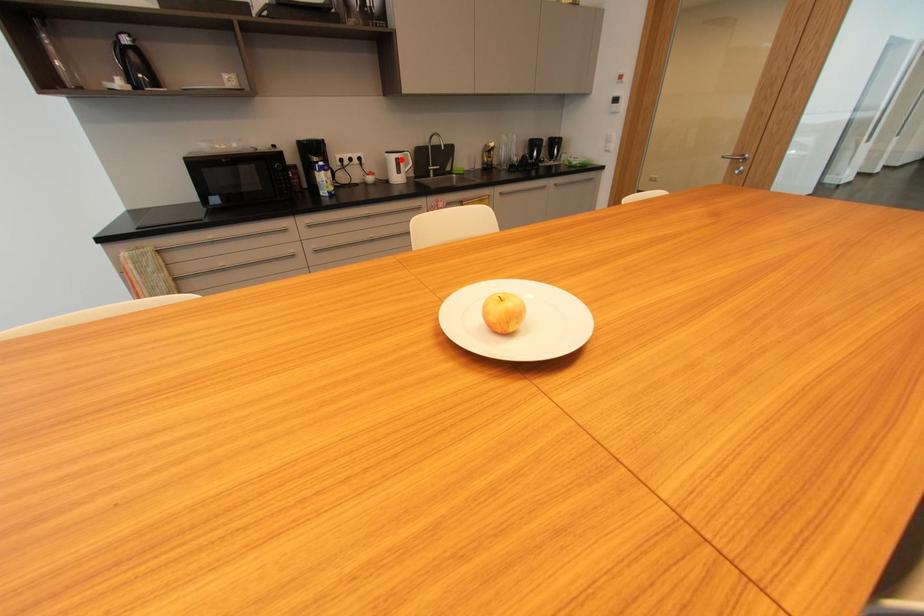
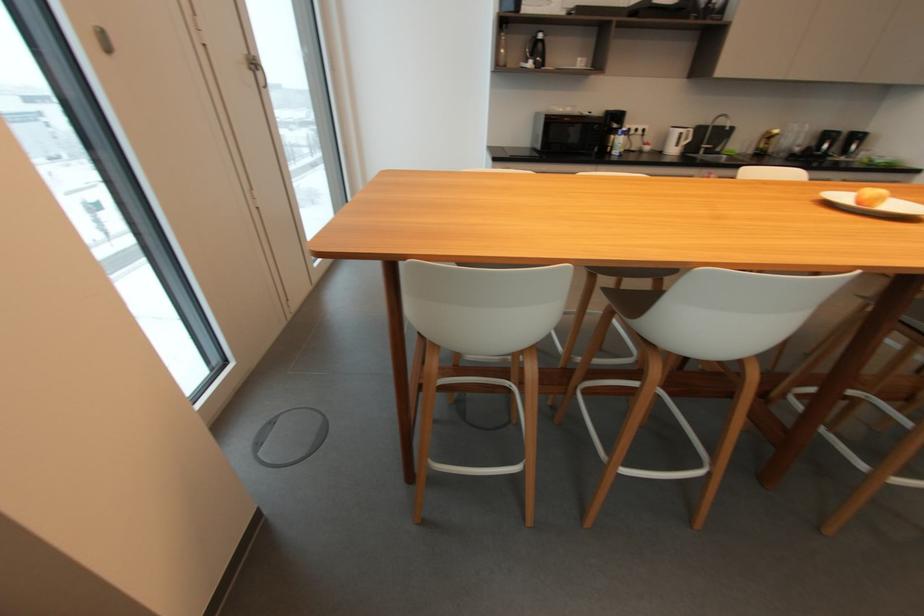
In the second image, find the point that corresponds to the highlighted location in the first image.

(685, 134)